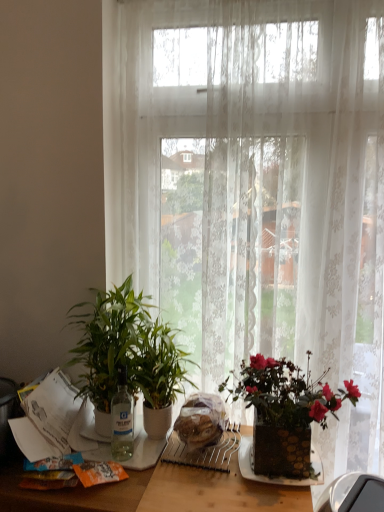
Locate an element on the screen. vacant space situated on the left part of translucent plastic bread at center is located at coordinates (148, 438).